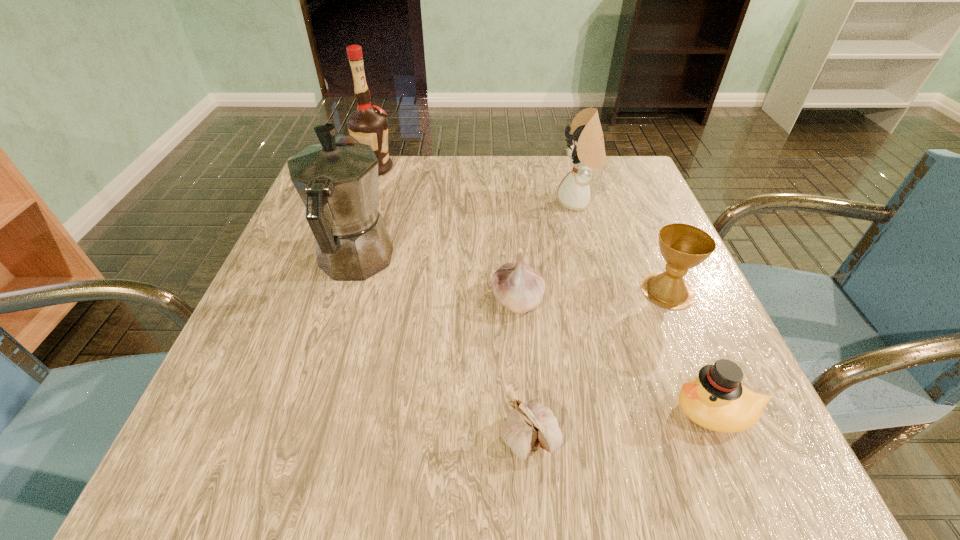
Where is `unoccupied position between the farthest object and the taller garlic`? unoccupied position between the farthest object and the taller garlic is located at coordinates (446, 234).

The height and width of the screenshot is (540, 960). I want to click on free point between the fifth shortest object and the chalice, so click(x=622, y=246).

Where is `free space between the farthest object and the duck`? free space between the farthest object and the duck is located at coordinates (545, 290).

Image resolution: width=960 pixels, height=540 pixels. I want to click on free space between the farthest object and the third tallest object, so click(476, 185).

At what (x,y) coordinates should I click in order to perform the action: click on free space between the chalice and the liquor. Please return your answer as a coordinate pair (x, y). This screenshot has width=960, height=540. Looking at the image, I should click on (521, 230).

Where is `vacant space that is in between the coffeepot and the third object from right to left`? The width and height of the screenshot is (960, 540). vacant space that is in between the coffeepot and the third object from right to left is located at coordinates (466, 232).

Identify the location of vacant space that's between the duck and the second farthest object. The image size is (960, 540). (646, 307).

Where is `object that can be found as the fourth closest to the nearer garlic`? object that can be found as the fourth closest to the nearer garlic is located at coordinates (337, 180).

Identify the location of object that is the fifth closest to the farther garlic. This screenshot has height=540, width=960. (716, 400).

Identify the location of vacant space that satisfies the following two spatial constraints: 1. on the front and back of the farthest object; 2. on the pouring side of the coffeepot. Image resolution: width=960 pixels, height=540 pixels. (345, 262).